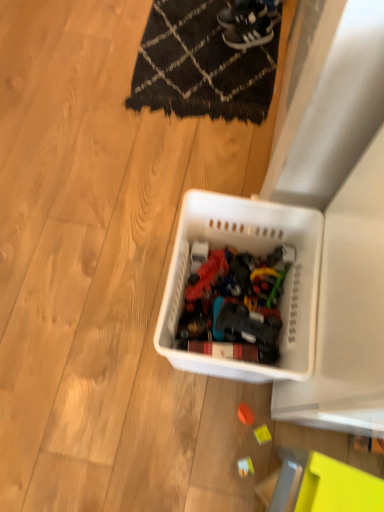
This screenshot has width=384, height=512. I want to click on white plastic basket at center, so click(x=254, y=255).

This screenshot has width=384, height=512. What do you see at coordinates (262, 434) in the screenshot?
I see `yellow plastic toy at lower right, the second toy viewed from the top` at bounding box center [262, 434].

The width and height of the screenshot is (384, 512). I want to click on white plastic basket at center, so click(254, 255).

Which is behind, point (271, 67) or point (245, 0)?

The point (245, 0) is behind.

Is black woven mat at upper center shorter than black suede sneakers at upper center, acting as the 1th footwear starting from the top?

Indeed, black woven mat at upper center has a lesser height compared to black suede sneakers at upper center, acting as the 1th footwear starting from the top.

From the image's perspective, which one is positioned higher, black woven mat at upper center or black suede sneakers at upper center, placed as the second footwear when sorted from bottom to top?

black suede sneakers at upper center, placed as the second footwear when sorted from bottom to top, is shown above in the image.

Is black woven mat at upper center next to black suede sneakers at upper center, placed as the second footwear when sorted from bottom to top, and touching it?

No, black woven mat at upper center is not next to black suede sneakers at upper center, placed as the second footwear when sorted from bottom to top.

Which point is more forward, (244, 477) or (227, 22)?

Point (244, 477)

Is the surface of white plastic toy at lower center, which ranks as the 1th toy in bottom-to-top order, in direct contact with black suede sneakers at upper center, placed as the second footwear when sorted from bottom to top?

No, white plastic toy at lower center, which ranks as the 1th toy in bottom-to-top order, is not beside black suede sneakers at upper center, placed as the second footwear when sorted from bottom to top.

From a real-world perspective, is white plastic toy at lower center, which ranks as the 1th toy in bottom-to-top order, physically above black suede sneakers at upper center, acting as the 1th footwear starting from the top?

No.

In the image, is white plastic toy at lower center, which ranks as the 1th toy in bottom-to-top order, positioned in front of or behind black suede sneakers at upper center, acting as the 1th footwear starting from the top?

white plastic toy at lower center, which ranks as the 1th toy in bottom-to-top order, is positioned closer to the viewer than black suede sneakers at upper center, acting as the 1th footwear starting from the top.

In order to click on the 1st toy positioned above the orange matte ball at center, acting as the 3th toy starting from the bottom (from a real-world perspective) in this screenshot , I will do `click(245, 467)`.

Is white plastic toy at lower center, which ranks as the 1th toy in bottom-to-top order, facing away from orange matte ball at center, acting as the 3th toy starting from the bottom?

white plastic toy at lower center, which ranks as the 1th toy in bottom-to-top order, is not turned away from orange matte ball at center, acting as the 3th toy starting from the bottom.

Is white plastic toy at lower center, the third toy in the top-to-bottom sequence, completely or partially outside of orange matte ball at center, which ranks as the 1th toy in top-to-bottom order?

→ That's correct, white plastic toy at lower center, the third toy in the top-to-bottom sequence, is outside of orange matte ball at center, which ranks as the 1th toy in top-to-bottom order.

Is point (252, 466) farther from viewer compared to point (253, 414)?

No, (252, 466) is closer to viewer.

Between orange matte ball at center, acting as the 3th toy starting from the bottom, and black suede sneakers at upper center, acting as the 1th footwear starting from the top, which one has smaller width?

orange matte ball at center, acting as the 3th toy starting from the bottom.

Measure the distance from orange matte ball at center, which ranks as the 1th toy in top-to-bottom order, to black suede sneakers at upper center, placed as the second footwear when sorted from bottom to top.

1.40 meters.

Does orange matte ball at center, acting as the 3th toy starting from the bottom, come in front of black suede sneakers at upper center, acting as the 1th footwear starting from the top?

Yes, orange matte ball at center, acting as the 3th toy starting from the bottom, is closer to the viewer.

How many degrees apart are the facing directions of orange matte ball at center, which ranks as the 1th toy in top-to-bottom order, and black suede sneakers at upper center, placed as the second footwear when sorted from bottom to top?

The angular difference between orange matte ball at center, which ranks as the 1th toy in top-to-bottom order, and black suede sneakers at upper center, placed as the second footwear when sorted from bottom to top, is 12.8 degrees.

Who is taller, black woven mat at upper center or white plastic basket at center?

white plastic basket at center.

Where is `mat that appears behind the white plastic basket at center`? mat that appears behind the white plastic basket at center is located at coordinates (201, 65).

Considering the relative positions of black woven mat at upper center and white plastic basket at center in the image provided, is black woven mat at upper center to the left or to the right of white plastic basket at center?

From the image, it's evident that black woven mat at upper center is to the left of white plastic basket at center.

From a real-world perspective, which object stands above the other?

white plastic basket at center.

Is white plastic basket at center inside black suede sneakers at upper center, placed as the second footwear when sorted from bottom to top?

No, black suede sneakers at upper center, placed as the second footwear when sorted from bottom to top, does not contain white plastic basket at center.

What's the angular difference between black suede sneakers at upper center, acting as the 1th footwear starting from the top, and white plastic basket at center's facing directions?

There is a 70.7-degree angle between the facing directions of black suede sneakers at upper center, acting as the 1th footwear starting from the top, and white plastic basket at center.

From the image's perspective, is black suede sneakers at upper center, placed as the second footwear when sorted from bottom to top, above white plastic basket at center?

Correct, black suede sneakers at upper center, placed as the second footwear when sorted from bottom to top, appears higher than white plastic basket at center in the image.

Based on their positions, is black suede sneakers at upper center, acting as the 1th footwear starting from the top, located to the left or right of white plastic basket at center?

In the image, black suede sneakers at upper center, acting as the 1th footwear starting from the top, appears on the right side of white plastic basket at center.

Between black suede sneakers at upper center, acting as the 1th footwear starting from the top, and white plastic toy at lower center, the third toy in the top-to-bottom sequence, which one has less height?

With less height is white plastic toy at lower center, the third toy in the top-to-bottom sequence.

Can you confirm if black suede sneakers at upper center, placed as the second footwear when sorted from bottom to top, is smaller than white plastic toy at lower center, the third toy in the top-to-bottom sequence?

Incorrect, black suede sneakers at upper center, placed as the second footwear when sorted from bottom to top, is not smaller in size than white plastic toy at lower center, the third toy in the top-to-bottom sequence.

Would you say black suede sneakers at upper center, placed as the second footwear when sorted from bottom to top, is outside white plastic toy at lower center, which ranks as the 1th toy in bottom-to-top order?

black suede sneakers at upper center, placed as the second footwear when sorted from bottom to top, lies outside white plastic toy at lower center, which ranks as the 1th toy in bottom-to-top order,'s area.

Where is `the 2nd footwear above the black woven mat at upper center (from a real-world perspective)`? The image size is (384, 512). the 2nd footwear above the black woven mat at upper center (from a real-world perspective) is located at coordinates click(x=241, y=13).

From a real-world perspective, which toy is the 2nd one underneath the black suede sneakers at upper center, acting as the 1th footwear starting from the top? Please provide its 2D coordinates.

[(245, 467)]

Consider the image. Which object lies further to the anchor point orange matte ball at center, acting as the 3th toy starting from the bottom, yellow plastic toy at lower right, the second toy viewed from the top, or white plastic basket at center?

The object further to orange matte ball at center, acting as the 3th toy starting from the bottom, is white plastic basket at center.

Estimate the real-world distances between objects in this image. Which object is closer to white plastic toy at lower center, the third toy in the top-to-bottom sequence, white leather sneakers at upper center, which is the second footwear from top to bottom, or black suede sneakers at upper center, placed as the second footwear when sorted from bottom to top?

white leather sneakers at upper center, which is the second footwear from top to bottom, is closer to white plastic toy at lower center, the third toy in the top-to-bottom sequence.

Looking at the image, which one is located closer to white leather sneakers at upper center, the first footwear from the bottom, white plastic toy at lower center, which ranks as the 1th toy in bottom-to-top order, or white plastic basket at center?

white plastic basket at center is positioned closer to the anchor white leather sneakers at upper center, the first footwear from the bottom.

Estimate the real-world distances between objects in this image. Which object is closer to orange matte ball at center, which ranks as the 1th toy in top-to-bottom order, black woven mat at upper center or white plastic toy at lower center, the third toy in the top-to-bottom sequence?

Among the two, white plastic toy at lower center, the third toy in the top-to-bottom sequence, is located nearer to orange matte ball at center, which ranks as the 1th toy in top-to-bottom order.

Looking at the image, which one is located closer to white leather sneakers at upper center, the first footwear from the bottom, white plastic basket at center or yellow plastic toy at lower right, the second toy viewed from the top?

white plastic basket at center is positioned closer to the anchor white leather sneakers at upper center, the first footwear from the bottom.

Based on the photo, based on their spatial positions, is white leather sneakers at upper center, which is the second footwear from top to bottom, or yellow plastic toy at lower right, the second toy viewed from the top, closer to black suede sneakers at upper center, acting as the 1th footwear starting from the top?

white leather sneakers at upper center, which is the second footwear from top to bottom, is positioned closer to the anchor black suede sneakers at upper center, acting as the 1th footwear starting from the top.

Which object lies nearer to the anchor point yellow plastic toy at lower right, arranged as the 2th toy when ordered from the bottom, orange matte ball at center, which ranks as the 1th toy in top-to-bottom order, or black woven mat at upper center?

orange matte ball at center, which ranks as the 1th toy in top-to-bottom order, is closer to yellow plastic toy at lower right, arranged as the 2th toy when ordered from the bottom.

From the image, which object appears to be farther from yellow plastic toy at lower right, the second toy viewed from the top, black suede sneakers at upper center, placed as the second footwear when sorted from bottom to top, or white plastic basket at center?

The object further to yellow plastic toy at lower right, the second toy viewed from the top, is black suede sneakers at upper center, placed as the second footwear when sorted from bottom to top.

Image resolution: width=384 pixels, height=512 pixels. Identify the location of storage box between black woven mat at upper center and yellow plastic toy at lower right, arranged as the 2th toy when ordered from the bottom, from top to bottom. pos(254,255).

Where is `mat between white leather sneakers at upper center, the first footwear from the bottom, and orange matte ball at center, acting as the 3th toy starting from the bottom, vertically`? Image resolution: width=384 pixels, height=512 pixels. mat between white leather sneakers at upper center, the first footwear from the bottom, and orange matte ball at center, acting as the 3th toy starting from the bottom, vertically is located at coordinates (201, 65).

Where is `footwear between black suede sneakers at upper center, acting as the 1th footwear starting from the top, and orange matte ball at center, which ranks as the 1th toy in top-to-bottom order, in the up-down direction`? This screenshot has height=512, width=384. footwear between black suede sneakers at upper center, acting as the 1th footwear starting from the top, and orange matte ball at center, which ranks as the 1th toy in top-to-bottom order, in the up-down direction is located at coordinates (249, 32).

You are a GUI agent. You are given a task and a screenshot of the screen. Output one action in this format:
    pyautogui.click(x=<x>, y=<y>)
    Task: Click on the storage box that lies between black woven mat at upper center and white plastic toy at lower center, the third toy in the top-to-bottom sequence, from top to bottom
    The image size is (384, 512).
    Given the screenshot: What is the action you would take?
    pyautogui.click(x=254, y=255)